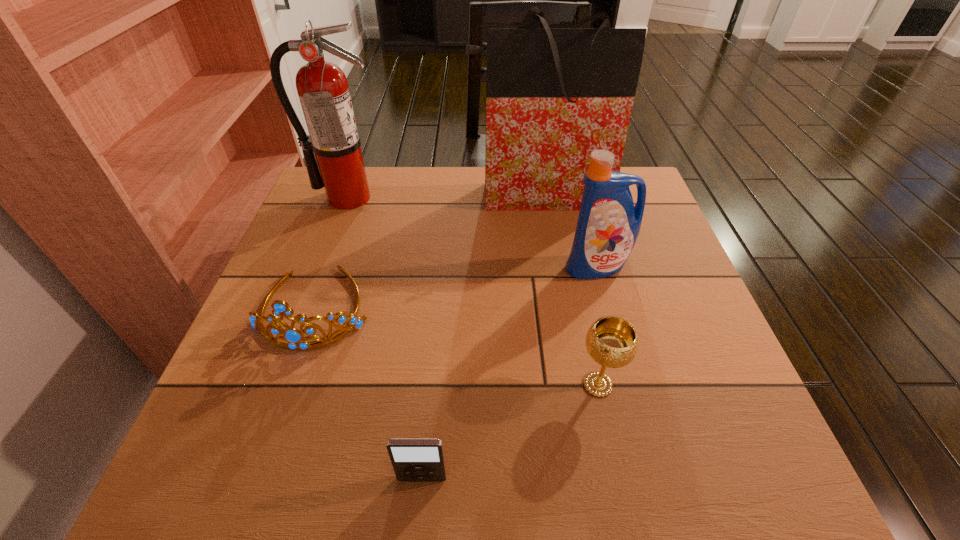
Where is `vacant area between the detergent and the shopping bag`? This screenshot has width=960, height=540. vacant area between the detergent and the shopping bag is located at coordinates (567, 231).

Find the location of a particular element. This screenshot has width=960, height=540. free spot between the third tallest object and the fire extinguisher is located at coordinates (472, 232).

This screenshot has height=540, width=960. I want to click on unoccupied area between the shopping bag and the third tallest object, so click(x=567, y=231).

This screenshot has height=540, width=960. I want to click on free space between the shopping bag and the detergent, so click(x=567, y=231).

Find the location of a particular element. free space between the tiara and the third tallest object is located at coordinates (457, 287).

Locate an element on the screen. The width and height of the screenshot is (960, 540). blank region between the fire extinguisher and the third object from left to right is located at coordinates (385, 338).

The height and width of the screenshot is (540, 960). I want to click on empty space that is in between the shopping bag and the fire extinguisher, so click(x=444, y=197).

Select which object is the second closest to the nearest object. Please provide its 2D coordinates. Your answer should be formatted as a tuple, i.e. [(x, y)], where the tuple contains the x and y coordinates of a point satisfying the conditions above.

[(611, 341)]

You are a GUI agent. You are given a task and a screenshot of the screen. Output one action in this format:
    pyautogui.click(x=<x>, y=<y>)
    Task: Click on the object identified as the closest to the fire extinguisher
    
    Given the screenshot: What is the action you would take?
    pyautogui.click(x=292, y=335)

The image size is (960, 540). I want to click on vacant region that satisfies the following two spatial constraints: 1. on the front side of the shopping bag; 2. on the left side of the second nearest object, so click(568, 384).